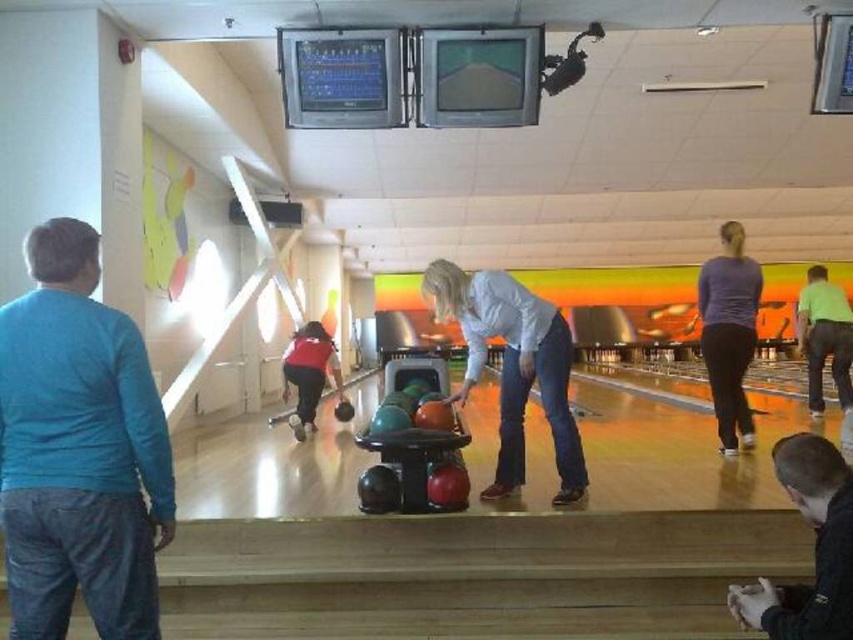
Is matte orange bowling ball at center wider than red fabric bowling ball at center?

Yes.

Does matte orange bowling ball at center appear on the right side of red fabric bowling ball at center?

Yes, matte orange bowling ball at center is to the right of red fabric bowling ball at center.

Find the location of a particular element. The width and height of the screenshot is (853, 640). matte orange bowling ball at center is located at coordinates click(x=514, y=365).

Can you confirm if black matte bowling ball at lower right is bigger than purple matte shirt at right?

No.

How distant is black matte bowling ball at lower right from purple matte shirt at right?

black matte bowling ball at lower right is 2.73 meters from purple matte shirt at right.

Is point (769, 636) behind point (746, 280)?

No, it is in front of (746, 280).

This screenshot has width=853, height=640. Identify the location of black matte bowling ball at lower right. (813, 552).

Does blue cotton shirt at left come behind red fabric bowling ball at center?

No.

Who is lower down, blue cotton shirt at left or red fabric bowling ball at center?

red fabric bowling ball at center is below.

The height and width of the screenshot is (640, 853). What do you see at coordinates (78, 449) in the screenshot? I see `blue cotton shirt at left` at bounding box center [78, 449].

Identify the location of blue cotton shirt at left. The height and width of the screenshot is (640, 853). (78, 449).